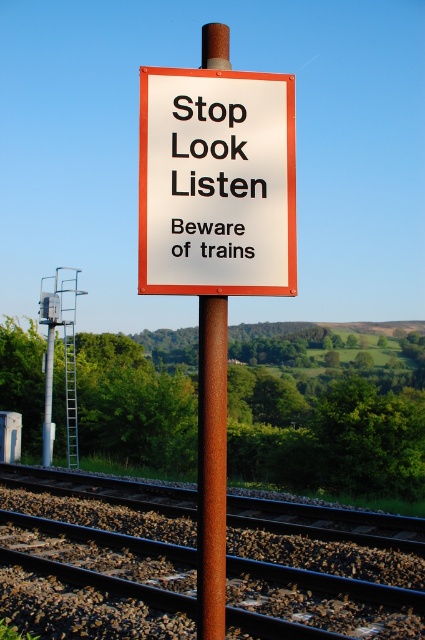
Question: Observing the image, what is the correct spatial positioning of white plastic sign at center in reference to black plastic sign at center?

Choices:
 (A) below
 (B) above

Answer: (A)

Question: Which object is the closest to the white plastic sign at center?

Choices:
 (A) black plastic sign at center
 (B) rusty metal tracks at lower center

Answer: (A)

Question: Can you confirm if rusty metal tracks at lower center is smaller than black plastic sign at center?

Choices:
 (A) no
 (B) yes

Answer: (A)

Question: Which point is closer to the camera?

Choices:
 (A) rusty metal tracks at lower center
 (B) white plastic sign at center
 (C) rusty metal pole at center
 (D) black plastic sign at center

Answer: (C)

Question: Which of the following is the farthest from the observer?

Choices:
 (A) rusty metal tracks at lower center
 (B) rusty metal pole at center
 (C) black plastic sign at center
 (D) white plastic sign at center

Answer: (A)

Question: Can you confirm if rusty metal tracks at lower center is positioned to the right of black plastic sign at center?

Choices:
 (A) yes
 (B) no

Answer: (B)